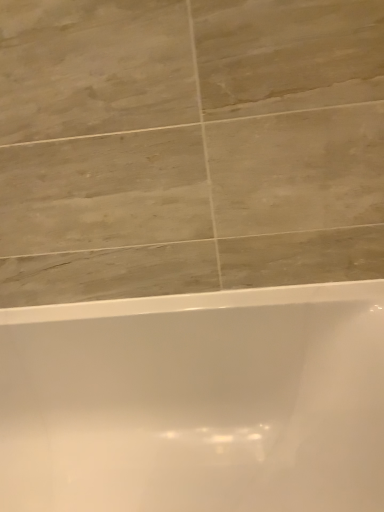
Where is `white glossy bathtub at lower center`? This screenshot has height=512, width=384. white glossy bathtub at lower center is located at coordinates (196, 402).

This screenshot has height=512, width=384. What do you see at coordinates (196, 402) in the screenshot? I see `white glossy bathtub at lower center` at bounding box center [196, 402].

Find the location of a particular element. white glossy bathtub at lower center is located at coordinates (196, 402).